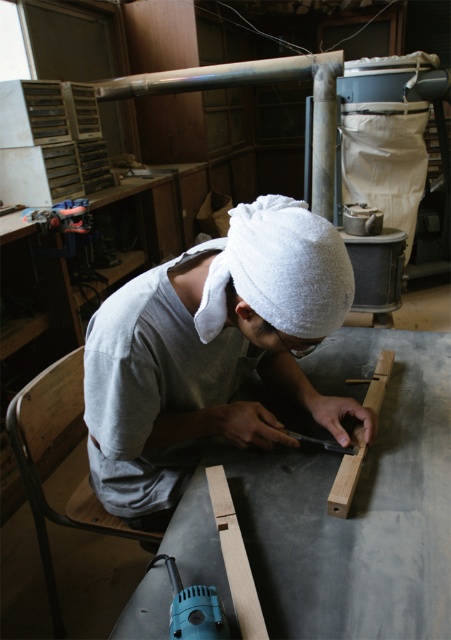
You are standing in the workshop and want to reach both the point at coordinates (303,353) and the point at coordinates (174,568). Which point is closer to you?

Point (303,353) is further to the viewer than point (174,568), so the point at (174,568) is closer to you.

You are a visitor in the workshop and want to know the position of the white towel at center and smooth bamboo at upper center. Which object is closer to you?

The white towel at center is closer to you because it is in front of the smooth bamboo at upper center.

You are a delivery person who needs to place a small package on the workbench without disturbing the person working. The package must be placed at least 30 inches away from the white towel at center. Can you safely place the package in this location?

The distance between the white towel at center and the camera is 29.61 inches. Since the required distance is at least 30 inches, placing the package at the current position would be too close. You need to move the package slightly further away from the white towel at center to meet the safety requirement.